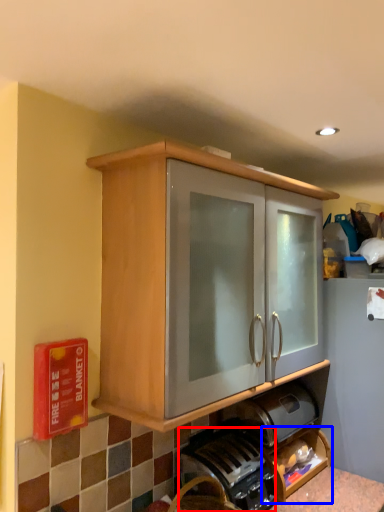
Question: Which object appears closest to the camera in this image, coffee machine (highlighted by a red box) or shelf (highlighted by a blue box)?

Choices:
 (A) coffee machine
 (B) shelf

Answer: (A)